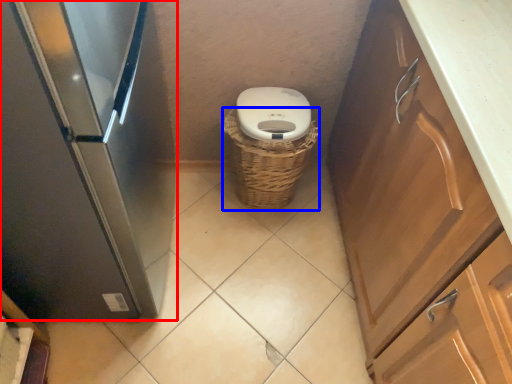
Question: Which object is further to the camera taking this photo, home appliance (highlighted by a red box) or basket (highlighted by a blue box)?

Choices:
 (A) home appliance
 (B) basket

Answer: (B)